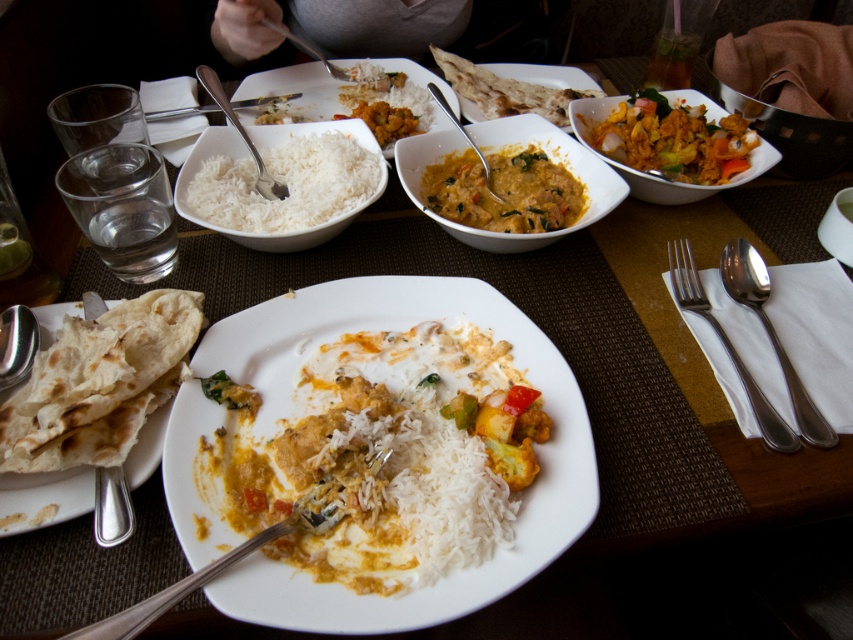
You are a server at a restaurant and need to place a new dish on the table. The dish is taller than the satin silver fork at upper center. Where can you place it without blocking the view of the rich yellow curry with vegetables at upper right?

Since the rich yellow curry with vegetables at upper right is not as tall as the satin silver fork at upper center, you can place the new dish near the satin silver fork at upper center. This way, the taller dish won

In the scene shown: You are a server in a restaurant and need to place a taller spoon on the left side of the table. You have a silver metallic spoon at left and a satin silver spoon at center. Which spoon should you choose for the left side?

You should choose the silver metallic spoon at left because it is taller than the satin silver spoon at center.